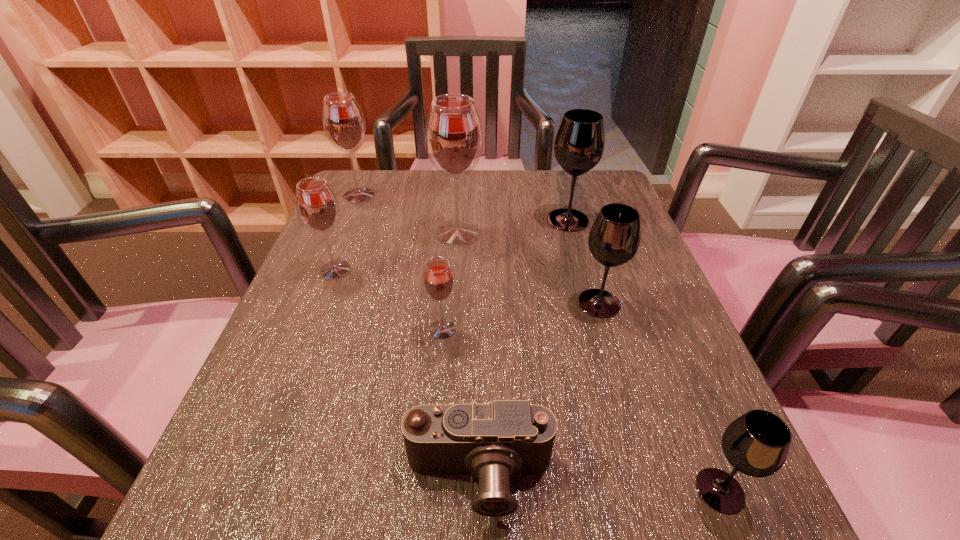
Locate an element on the screen. the tallest object is located at coordinates (453, 134).

Where is `the second farthest red wineglass`? Image resolution: width=960 pixels, height=540 pixels. the second farthest red wineglass is located at coordinates (453, 134).

The height and width of the screenshot is (540, 960). What are the coordinates of `the second biggest red wineglass` in the screenshot? It's located at (343, 121).

This screenshot has width=960, height=540. Find the location of `the farthest red wineglass`. the farthest red wineglass is located at coordinates (343, 121).

Where is `the farthest gray wineglass`? the farthest gray wineglass is located at coordinates click(579, 144).

Locate an element on the screen. The height and width of the screenshot is (540, 960). the third biggest red wineglass is located at coordinates (317, 206).

Locate an element on the screen. This screenshot has height=540, width=960. the third farthest red wineglass is located at coordinates (317, 206).

You are a GUI agent. You are given a task and a screenshot of the screen. Output one action in this format:
    pyautogui.click(x=<x>, y=<y>)
    Task: Click on the second nearest gray wineglass
    
    Given the screenshot: What is the action you would take?
    pyautogui.click(x=614, y=238)

Where is `the smallest red wineglass`? This screenshot has width=960, height=540. the smallest red wineglass is located at coordinates (438, 280).

Where is `the rightmost object`? This screenshot has height=540, width=960. the rightmost object is located at coordinates (757, 443).